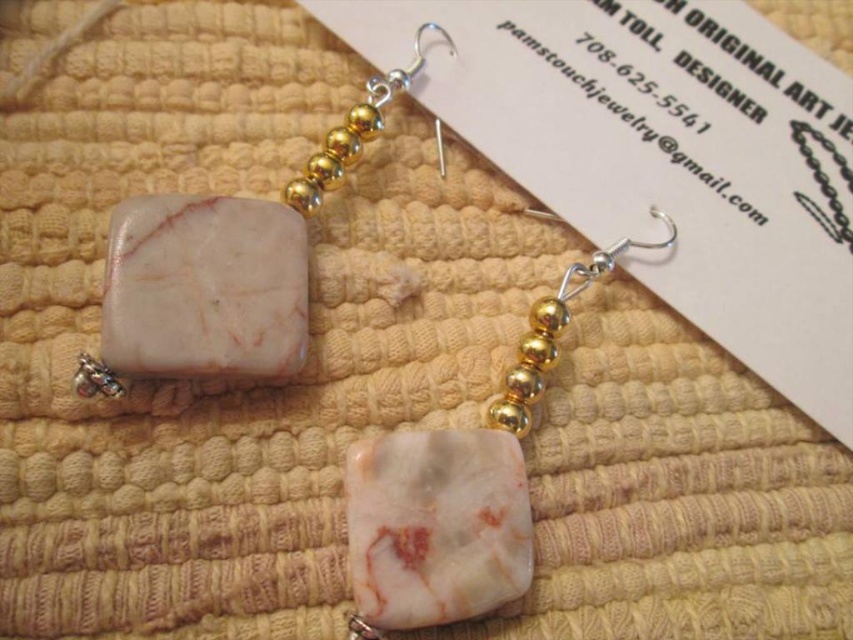
You are an interior designer planning to place a small decorative item between the two points, point (306,288) and point (370,560). Based on their positions, which point is closer to the front of the scene?

Point (370,560) is closer to the front of the scene because point (306,288) is behind it.